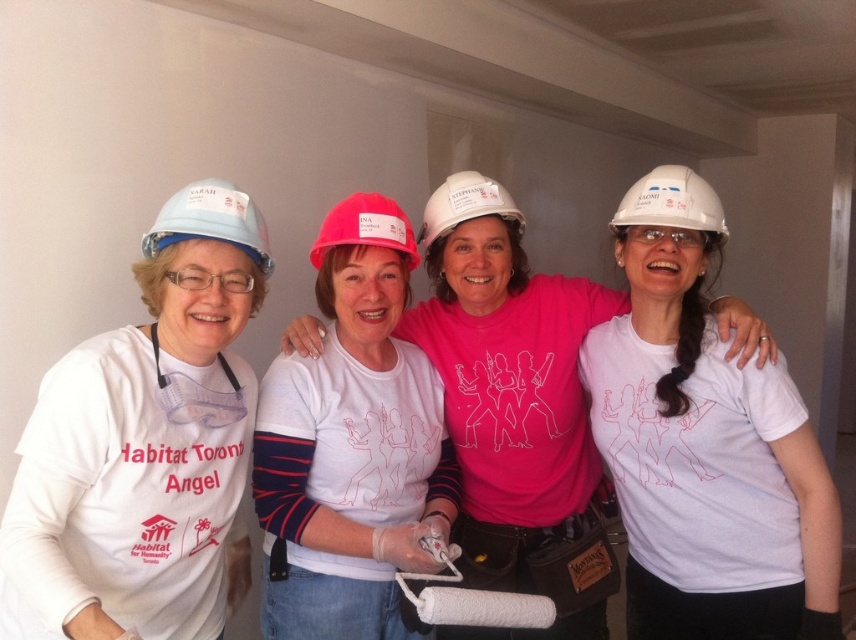
From the picture: Is white matte t-shirt at center further to the viewer compared to matte white helmet at left?

Yes.

Is white matte t-shirt at center closer to the viewer compared to matte white helmet at left?

No.

Does point (634, 476) lie in front of point (265, 273)?

No, it is behind (265, 273).

At what (x,y) coordinates should I click in order to perform the action: click on white matte t-shirt at center. Please return your answer as a coordinate pair (x, y). Looking at the image, I should click on (704, 444).

Is point (485, 333) less distant than point (421, 241)?

Yes, point (485, 333) is in front of point (421, 241).

Is point (568, 285) positioned before point (450, 173)?

That is True.

The image size is (856, 640). I want to click on white matte hard hat at center, so click(510, 387).

Between white matte hard hat at center and white hard hat at upper right, which one is positioned lower?

white matte hard hat at center is lower down.

Is white matte hard hat at center above white hard hat at upper right?

Actually, white matte hard hat at center is below white hard hat at upper right.

The image size is (856, 640). I want to click on white matte hard hat at center, so click(x=510, y=387).